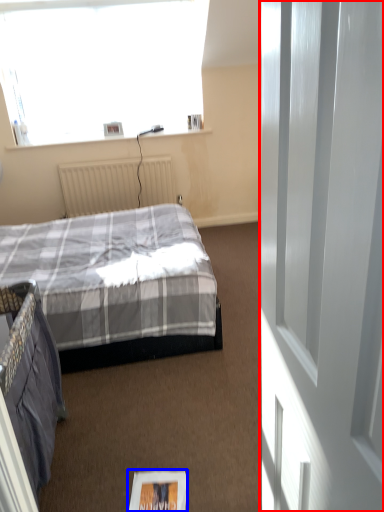
Question: Which object is closer to the camera taking this photo, screen door (highlighted by a red box) or magazine (highlighted by a blue box)?

Choices:
 (A) screen door
 (B) magazine

Answer: (A)